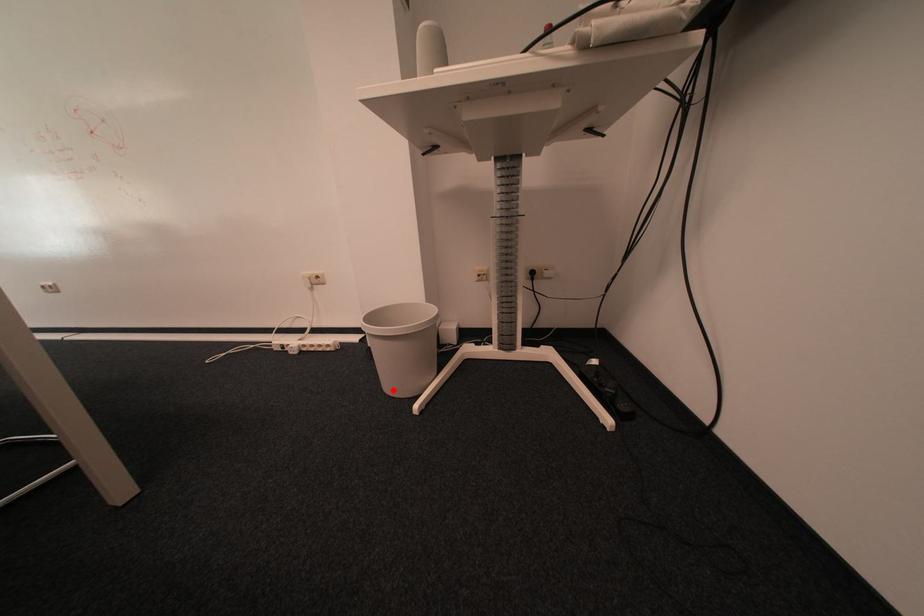
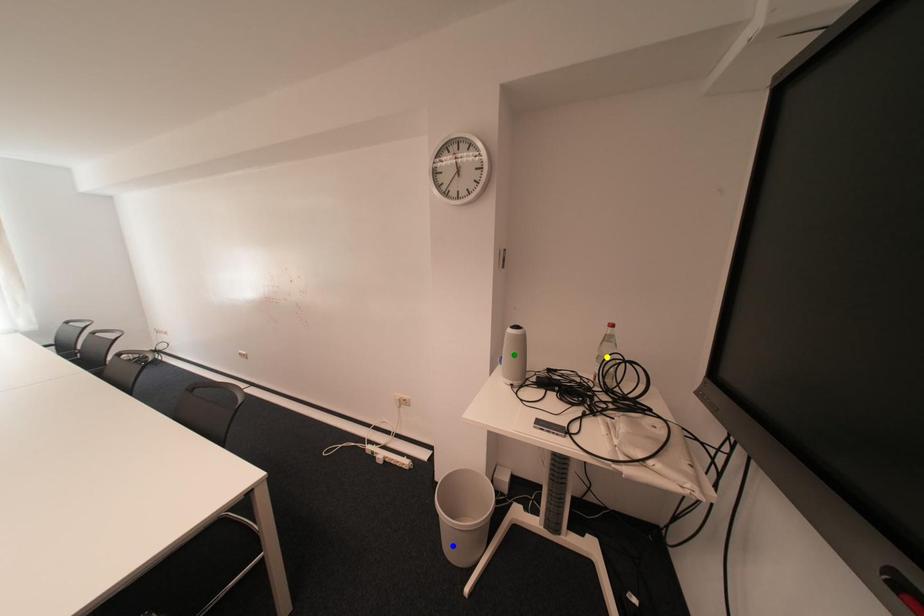
Question: I am providing you with two images of the same scene from different viewpoints. A red point is marked on the first image. You are given multiple points on the second image. Which spot in image 2 lines up with the point in image 1?

Choices:
 (A) blue point
 (B) green point
 (C) yellow point

Answer: (A)